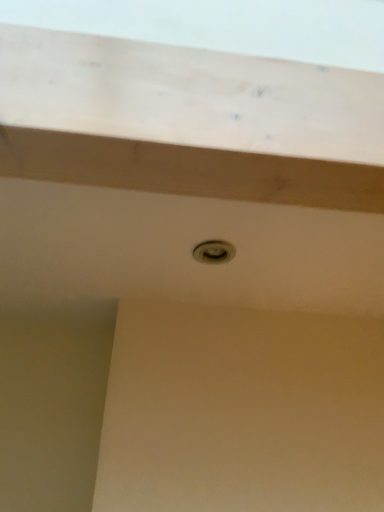
What is the approximate width of matte gray hole at center?

3.24 inches.

Identify the location of matte gray hole at center. (214, 252).

What do you see at coordinates (214, 252) in the screenshot? I see `matte gray hole at center` at bounding box center [214, 252].

You are a GUI agent. You are given a task and a screenshot of the screen. Output one action in this format:
    pyautogui.click(x=<x>, y=<y>)
    Task: Click on the matte gray hole at center
    
    Given the screenshot: What is the action you would take?
    pyautogui.click(x=214, y=252)